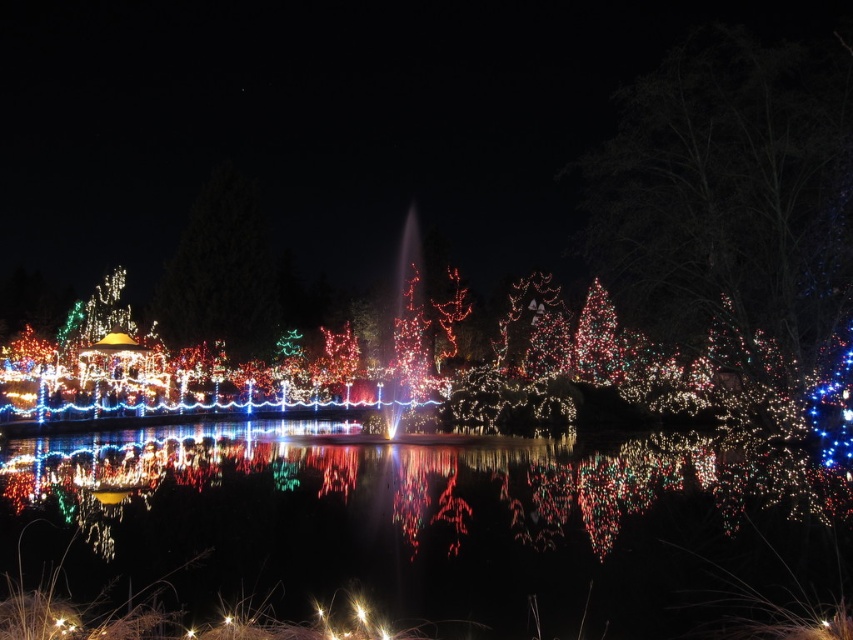
Question: Which point is farther from the camera taking this photo?

Choices:
 (A) (303, 424)
 (B) (247, 292)
 (C) (815, 228)

Answer: (B)

Question: Is the position of illuminated plastic tree at upper right more distant than that of illuminated plastic tree at upper center?

Choices:
 (A) yes
 (B) no

Answer: (B)

Question: Which of the following is the farthest from the observer?

Choices:
 (A) glistening reflective water at bottom
 (B) illuminated plastic tree at upper right

Answer: (B)

Question: Which object is closer to the camera taking this photo?

Choices:
 (A) illuminated plastic tree at upper center
 (B) illuminated plastic tree at upper right

Answer: (B)

Question: Does illuminated plastic tree at upper right have a lesser width compared to illuminated plastic tree at upper center?

Choices:
 (A) no
 (B) yes

Answer: (A)

Question: Does glistening reflective water at bottom appear over illuminated plastic tree at upper center?

Choices:
 (A) yes
 (B) no

Answer: (B)